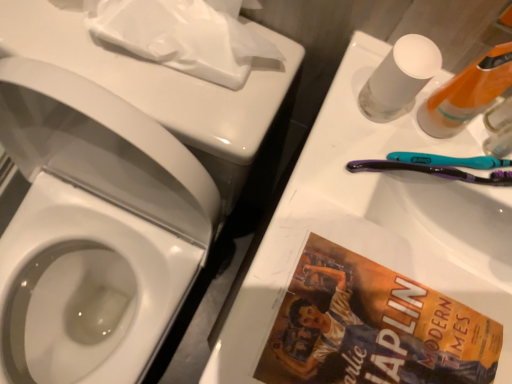
Question: In the image, is white matte toilet paper at upper left positioned in front of or behind translucent plastic bottle at upper right, the 1th mouthwash when ordered from right to left?

Choices:
 (A) behind
 (B) front

Answer: (A)

Question: Would you say white matte toilet paper at upper left is to the left or to the right of translucent plastic bottle at upper right, placed as the second mouthwash when sorted from left to right, in the picture?

Choices:
 (A) right
 (B) left

Answer: (B)

Question: Which object is the farthest from the white glossy sink at upper right?

Choices:
 (A) translucent plastic bottle at upper right, the 1th mouthwash when ordered from right to left
 (B) purple plastic toothbrush at right
 (C) white matte toilet paper at upper left
 (D) transparent plastic mouthwash at upper right, which is the second mouthwash in right-to-left order
 (E) orange plastic bottle at upper right

Answer: (C)

Question: Which object is the farthest from the translucent plastic bottle at upper right, the 1th mouthwash when ordered from right to left?

Choices:
 (A) orange plastic bottle at upper right
 (B) white matte toilet paper at upper left
 (C) purple plastic toothbrush at right
 (D) transparent plastic mouthwash at upper right, which is the second mouthwash in right-to-left order
 (E) white glossy sink at upper right

Answer: (B)